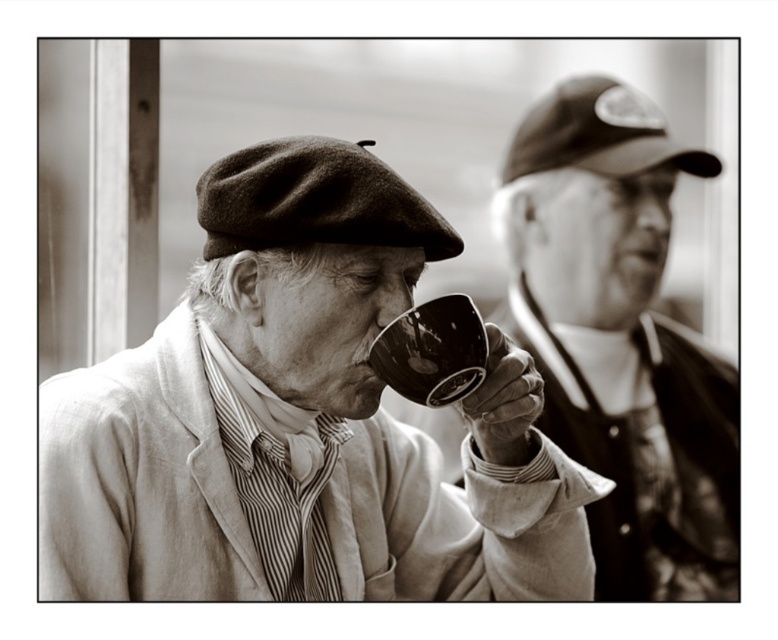
Question: Which point appears closest to the camera in this image?

Choices:
 (A) (286, 388)
 (B) (643, 189)
 (C) (440, 332)

Answer: (C)

Question: Among these objects, which one is nearest to the camera?

Choices:
 (A) matte black cup at center
 (B) matte black cup at right

Answer: (A)

Question: Which point is farther from the camera taking this photo?

Choices:
 (A) (363, 413)
 (B) (391, 358)
 (C) (584, 241)

Answer: (C)

Question: Is matte black cup at center thinner than matte black cup at right?

Choices:
 (A) yes
 (B) no

Answer: (A)

Question: Can you confirm if matte black cup at right is positioned to the right of glossy ceramic mug at upper center?

Choices:
 (A) yes
 (B) no

Answer: (A)

Question: Is matte black cup at right above glossy ceramic mug at upper center?

Choices:
 (A) yes
 (B) no

Answer: (B)